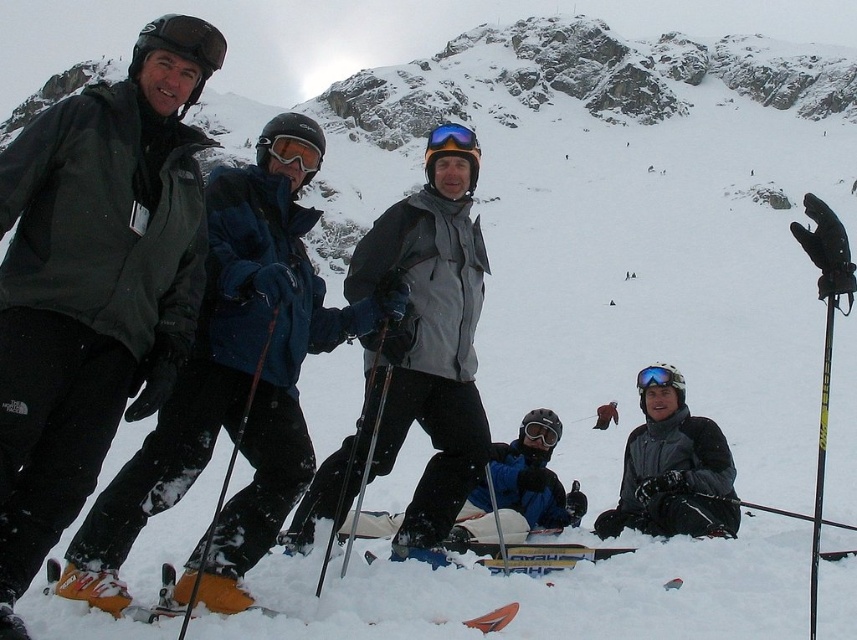
Does yellow matte ski at center have a greater height compared to blue reflective lens goggles at center?

Incorrect, yellow matte ski at center's height is not larger of blue reflective lens goggles at center's.

Can you confirm if yellow matte ski at center is positioned to the left of blue reflective lens goggles at center?

Incorrect, yellow matte ski at center is not on the left side of blue reflective lens goggles at center.

Is point (483, 541) positioned before point (447, 122)?

Yes, point (483, 541) is closer to viewer.

Identify the location of yellow matte ski at center. This screenshot has width=857, height=640. (534, 554).

Which is below, orange plastic ski at lower left or blue reflective lens goggles at center?

orange plastic ski at lower left is below.

How distant is orange plastic ski at lower left from blue reflective lens goggles at center?

orange plastic ski at lower left and blue reflective lens goggles at center are 120.07 feet apart from each other.

Locate an element on the screen. This screenshot has height=640, width=857. orange plastic ski at lower left is located at coordinates (159, 600).

Identify the location of orange plastic ski at lower left. (159, 600).

Can you confirm if matte black ski at left is wider than yellow matte ski at center?

Yes, matte black ski at left is wider than yellow matte ski at center.

How distant is matte black ski at left from yellow matte ski at center?

They are 11.85 meters apart.

At what (x,y) coordinates should I click in order to perform the action: click on matte black ski at left. Please return your answer as a coordinate pair (x, y). This screenshot has height=640, width=857. Looking at the image, I should click on (232, 378).